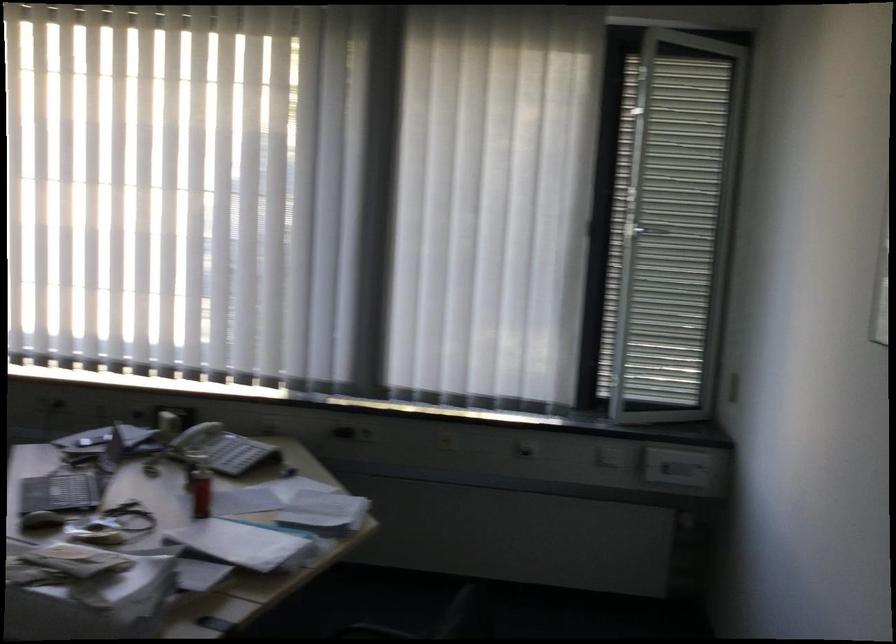
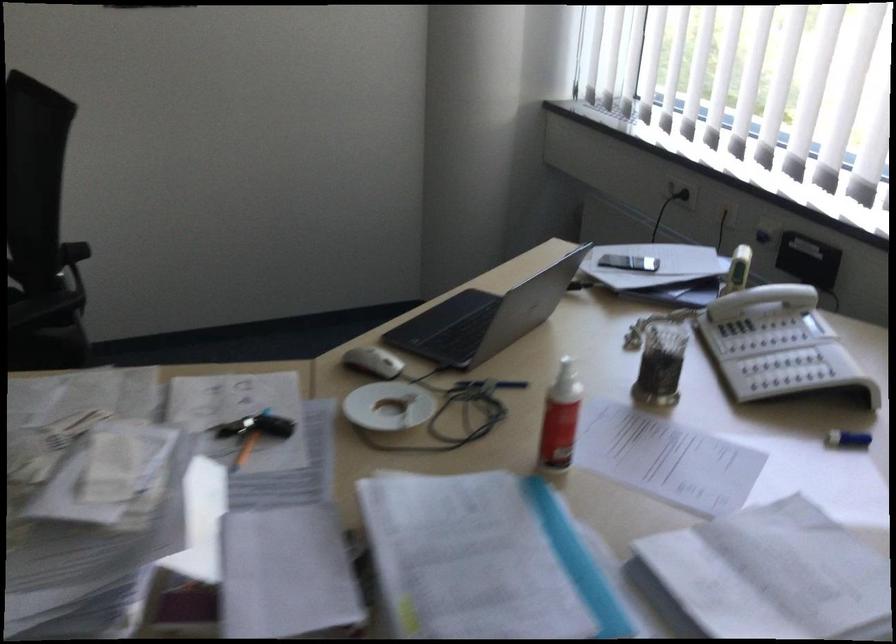
Locate, in the second image, the point that corresponds to pixel 114 526 in the first image.

(394, 413)